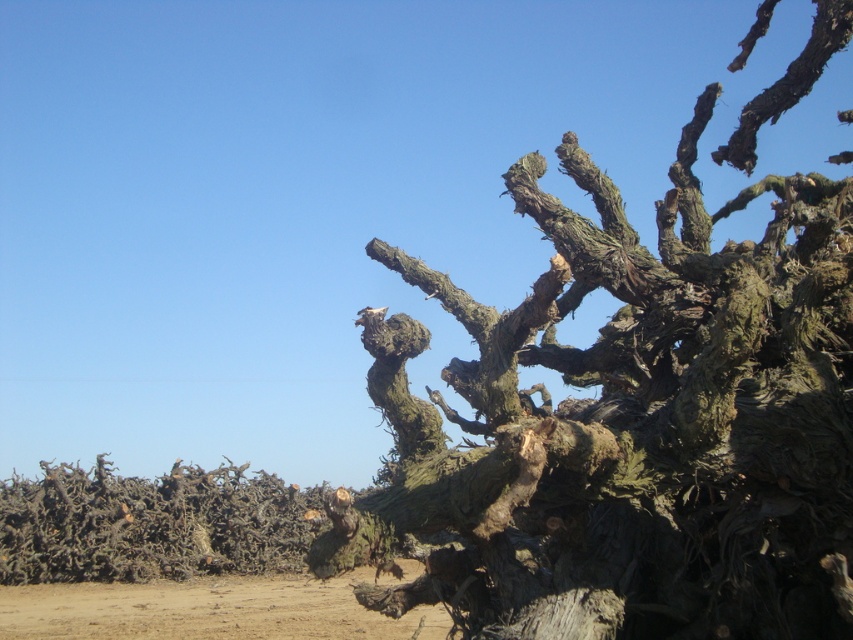
Question: Which object appears farthest from the camera in this image?

Choices:
 (A) brown sandy dirt at lower left
 (B) greenish-brown rough bark at upper right

Answer: (A)

Question: Can you confirm if greenish-brown rough bark at upper right is bigger than brown sandy dirt at lower left?

Choices:
 (A) yes
 (B) no

Answer: (B)

Question: Is greenish-brown rough bark at upper right thinner than brown sandy dirt at lower left?

Choices:
 (A) yes
 (B) no

Answer: (A)

Question: Which point is closer to the camera?

Choices:
 (A) brown sandy dirt at lower left
 (B) greenish-brown rough bark at upper right

Answer: (B)

Question: Among these points, which one is farthest from the camera?

Choices:
 (A) (305, 604)
 (B) (834, 237)

Answer: (A)

Question: Is greenish-brown rough bark at upper right wider than brown sandy dirt at lower left?

Choices:
 (A) yes
 (B) no

Answer: (B)